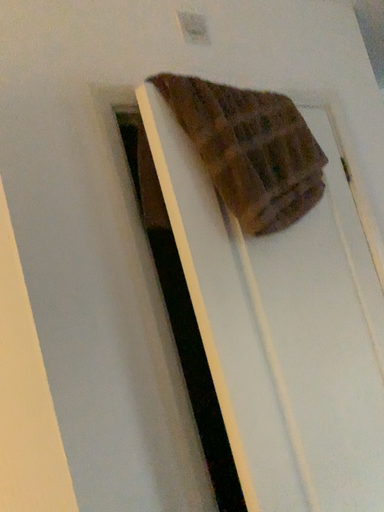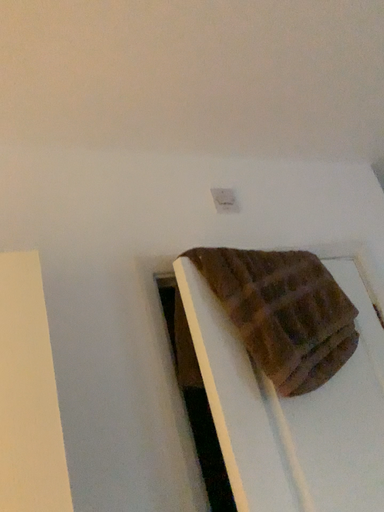
Question: Which way did the camera rotate in the video?

Choices:
 (A) rotated left
 (B) rotated right

Answer: (A)